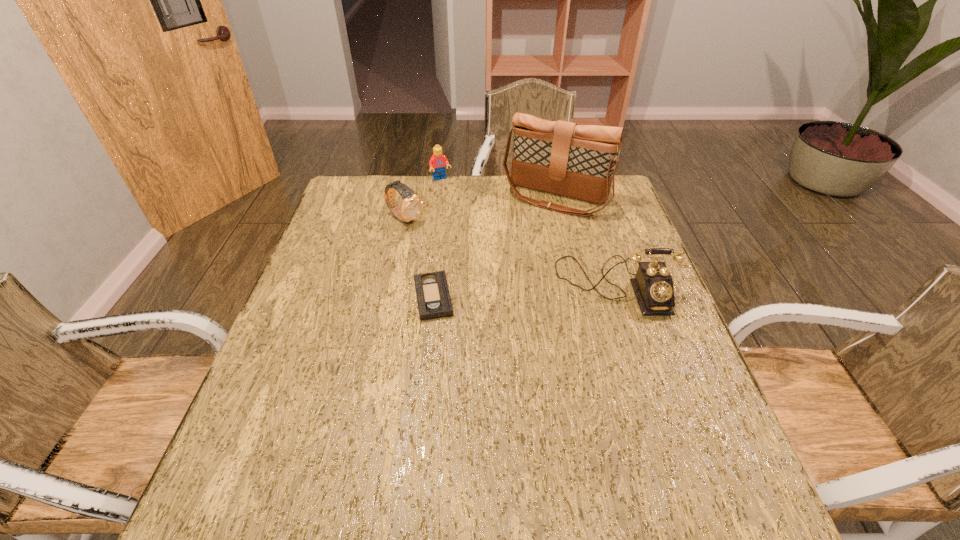
Where is `object that is the fourth closest to the Lego`? Image resolution: width=960 pixels, height=540 pixels. object that is the fourth closest to the Lego is located at coordinates 653,285.

This screenshot has width=960, height=540. I want to click on free space in the image that satisfies the following two spatial constraints: 1. on the back side of the tallest object; 2. on the left side of the videotape, so click(x=444, y=198).

Image resolution: width=960 pixels, height=540 pixels. Identify the location of vacant space that satisfies the following two spatial constraints: 1. on the front side of the watch; 2. on the left side of the videotape. (388, 298).